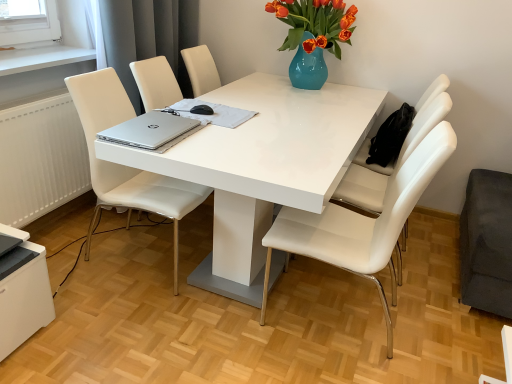
Locate an element on the screen. The image size is (512, 384). vacant space in front of silver metallic laptop at center is located at coordinates (220, 139).